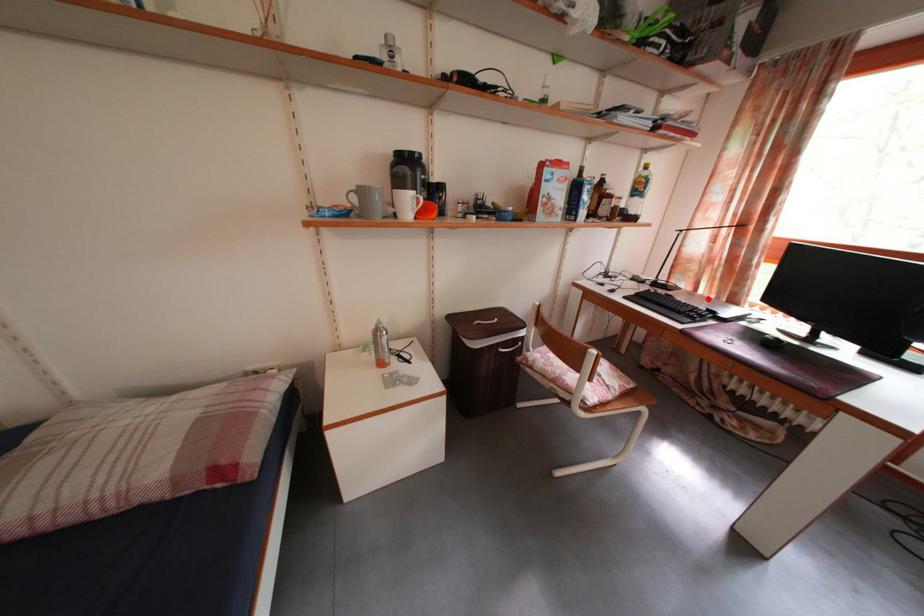
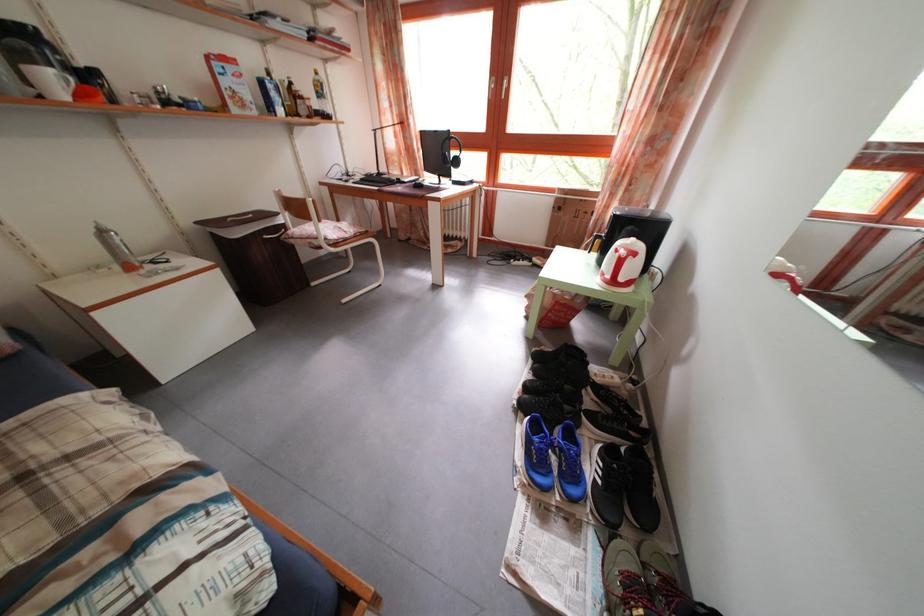
Question: I am providing you with two images of the same scene from different viewpoints. In image1, a red point is highlighted. Considering the same 3D point in image2, which of the following is correct?

Choices:
 (A) It is closer
 (B) It is farther

Answer: (A)